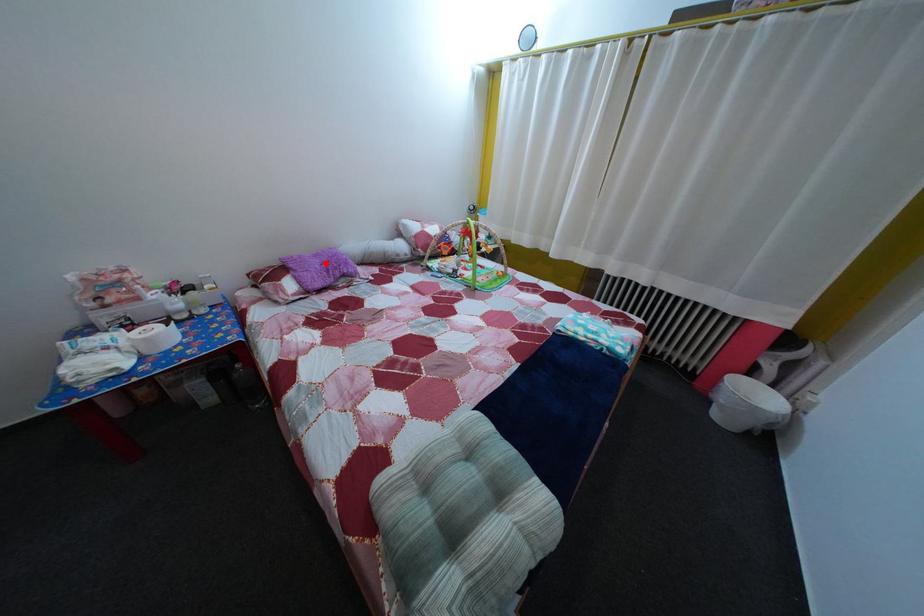
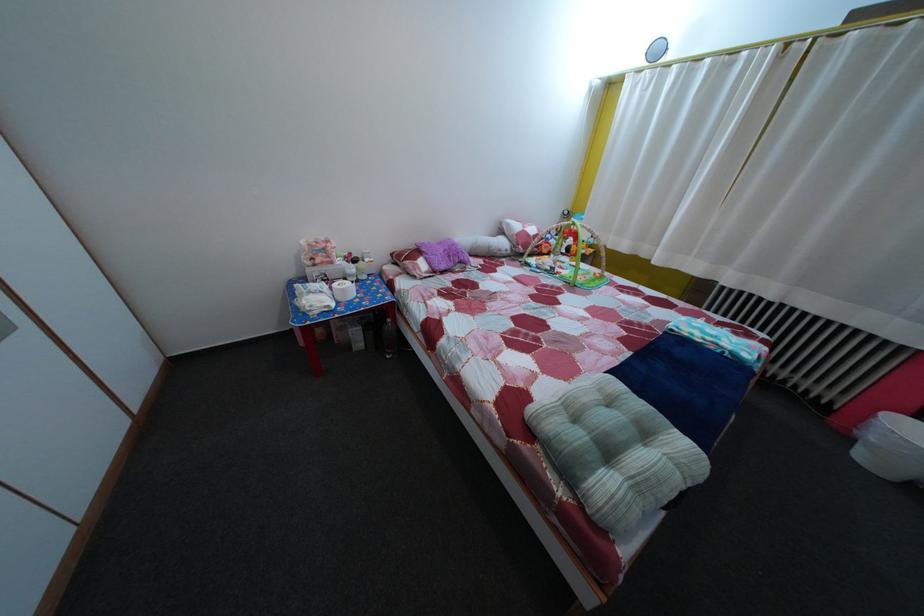
Locate, in the second image, the point that corresponds to the highlighted location in the first image.

(450, 252)